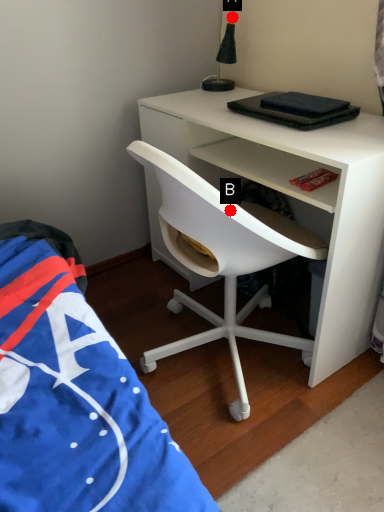
Question: Two points are circled on the image, labeled by A and B beside each circle. Among these points, which one is farthest from the camera?

Choices:
 (A) A is further
 (B) B is further

Answer: (A)